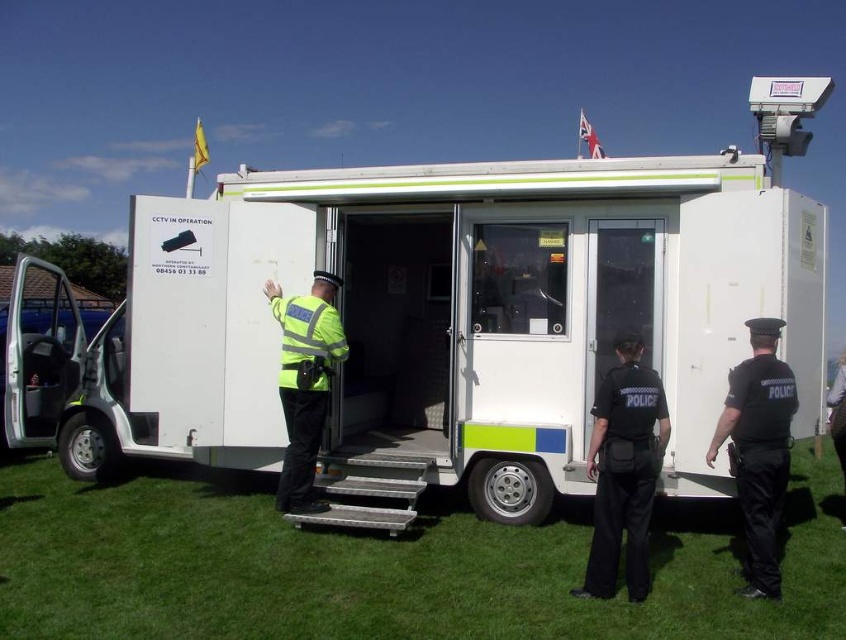
Does black uniform at center have a larger size compared to black uniform at right?

Actually, black uniform at center might be smaller than black uniform at right.

Between black uniform at center and black uniform at right, which one appears on the right side from the viewer's perspective?

black uniform at right is more to the right.

At what (x,y) coordinates should I click in order to perform the action: click on black uniform at center. Please return your answer as a coordinate pair (x, y). The height and width of the screenshot is (640, 846). Looking at the image, I should click on (624, 470).

This screenshot has width=846, height=640. Identify the location of black uniform at center. (624, 470).

Is black uniform at right to the left of high visibility reflective jacket at center from the viewer's perspective?

In fact, black uniform at right is to the right of high visibility reflective jacket at center.

Between point (779, 333) and point (322, 340), which one is positioned behind?

Positioned behind is point (322, 340).

Which is in front, point (743, 465) or point (312, 477)?

Point (743, 465)

The width and height of the screenshot is (846, 640). I want to click on black uniform at right, so click(x=759, y=451).

Does point (757, 276) lie in front of point (810, 532)?

That is True.

Who is shorter, white plastic trailer at center or green grass at lower center?

Standing shorter between the two is green grass at lower center.

The height and width of the screenshot is (640, 846). Describe the element at coordinates (452, 323) in the screenshot. I see `white plastic trailer at center` at that location.

Locate an element on the screen. The image size is (846, 640). white plastic trailer at center is located at coordinates (452, 323).